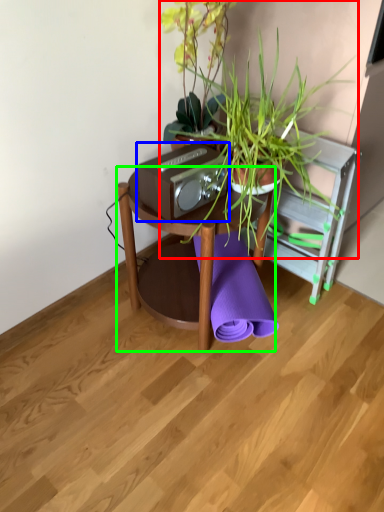
Question: Estimate the real-world distances between objects in this image. Which object is closer to houseplant (highlighted by a red box), stereo (highlighted by a blue box) or table (highlighted by a green box)?

Choices:
 (A) stereo
 (B) table

Answer: (A)